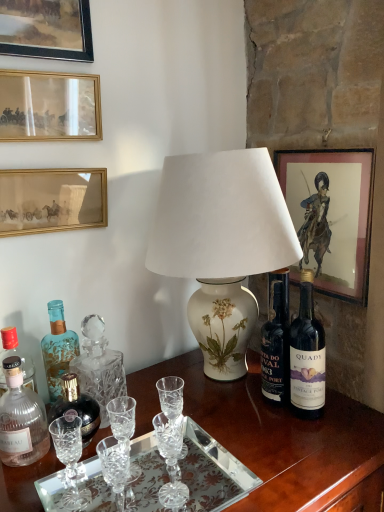
Identify the location of free spot in front of translucent glass bottle at left, marked as the 1th bottle in a front-to-back arrangement. (27, 487).